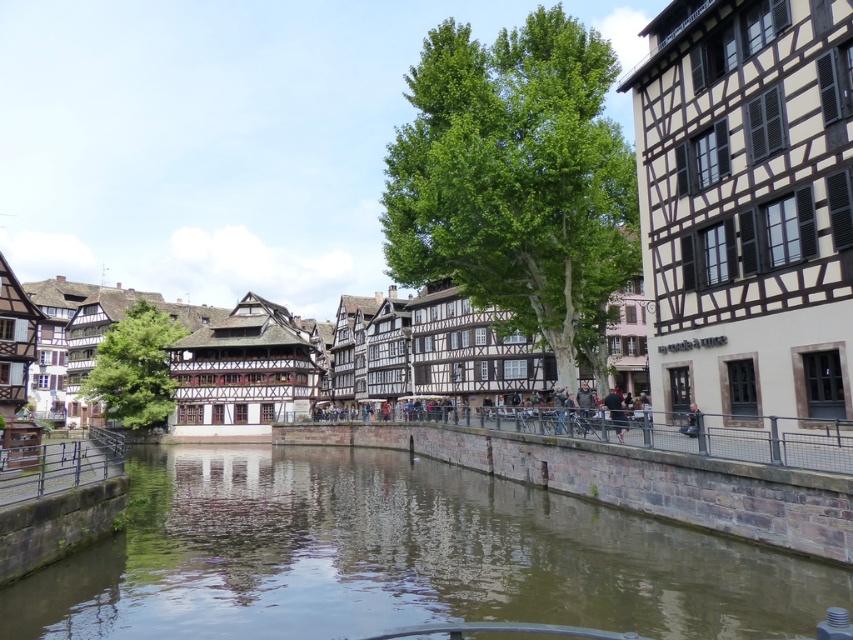
You are a photographer standing at the edge of the canal and want to take a photo that includes both point (160, 508) and point (694, 410). Based on their positions, which point will appear closer to the bottom of the photo?

Point (160, 508) is further to the camera than point (694, 410), so in the photo, point (694, 410) will appear closer to the bottom of the photo because it is farther from the camera.

In the scene shown: You are standing at the point marked as point (396, 557) in the canal scene. What is the name of the feature located exactly at this coordinate?

The feature located at point (396, 557) is the brown stone river at center.

You are standing at the point marked as point (x=346, y=360) in the canal scene. What type of building do you see directly in front of you?

The white wood timbered house at center is located at point (x=346, y=360), so you would see the white wood timbered house at center directly in front of you.